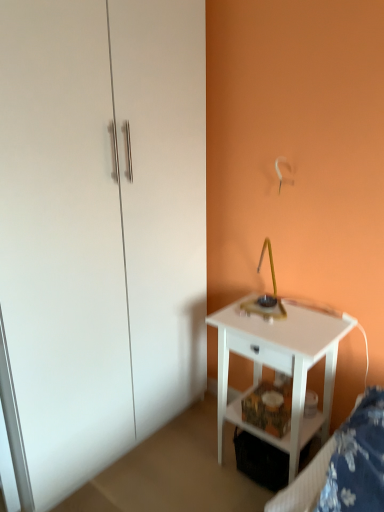
Question: Is white fabric bed frame at lower right spatially inside white glossy nightstand at lower right, or outside of it?

Choices:
 (A) inside
 (B) outside

Answer: (B)

Question: Considering their positions, is white fabric bed frame at lower right located in front of or behind white glossy nightstand at lower right?

Choices:
 (A) behind
 (B) front

Answer: (B)

Question: Which object is positioned closest to the white fabric bed frame at lower right?

Choices:
 (A) white glossy nightstand at lower right
 (B) white glossy dresser at left

Answer: (A)

Question: Which object is the farthest from the white glossy nightstand at lower right?

Choices:
 (A) white glossy dresser at left
 (B) white fabric bed frame at lower right

Answer: (A)